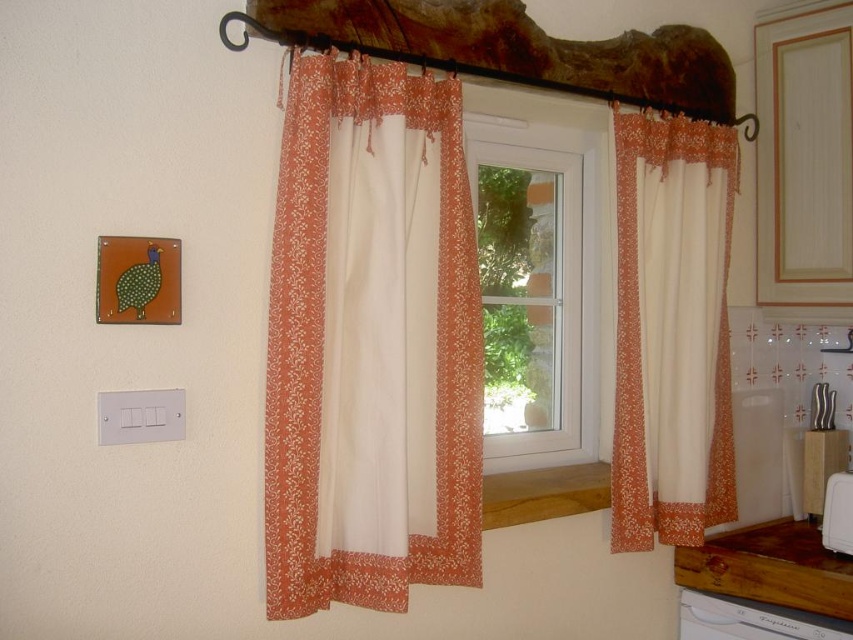
Question: Can you confirm if orange floral fabric curtains at center is positioned to the right of white plastic dishwasher at lower right?

Choices:
 (A) yes
 (B) no

Answer: (B)

Question: Is floral lace curtain at right above white plastic dishwasher at lower right?

Choices:
 (A) yes
 (B) no

Answer: (A)

Question: Which object appears closest to the camera in this image?

Choices:
 (A) floral lace curtain at right
 (B) white glossy refrigerator at lower right
 (C) transparent glass window at center

Answer: (A)

Question: Which of the following is the farthest from the observer?

Choices:
 (A) floral lace curtain at right
 (B) white glossy refrigerator at lower right
 (C) orange floral fabric curtains at center
 (D) white plastic dishwasher at lower right

Answer: (B)

Question: Is transparent glass window at center to the left of white glossy refrigerator at lower right from the viewer's perspective?

Choices:
 (A) yes
 (B) no

Answer: (A)

Question: Among these points, which one is nearest to the camera?

Choices:
 (A) (740, 625)
 (B) (544, 257)

Answer: (A)